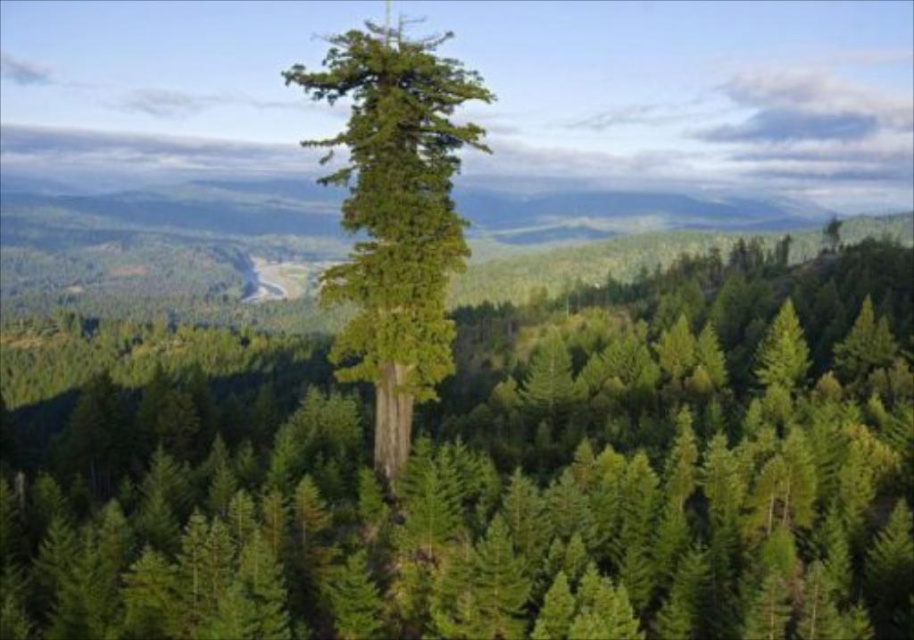
Question: Which point appears closest to the camera in this image?

Choices:
 (A) (767, 429)
 (B) (445, 278)

Answer: (B)

Question: Does green textured tree at center appear on the left side of green rough bark tree at center?

Choices:
 (A) no
 (B) yes

Answer: (A)

Question: Can you confirm if green textured tree at center is thinner than green rough bark tree at center?

Choices:
 (A) yes
 (B) no

Answer: (B)

Question: Is green textured tree at center bigger than green rough bark tree at center?

Choices:
 (A) no
 (B) yes

Answer: (A)

Question: Among these objects, which one is farthest from the camera?

Choices:
 (A) green rough bark tree at center
 (B) green textured tree at center

Answer: (A)